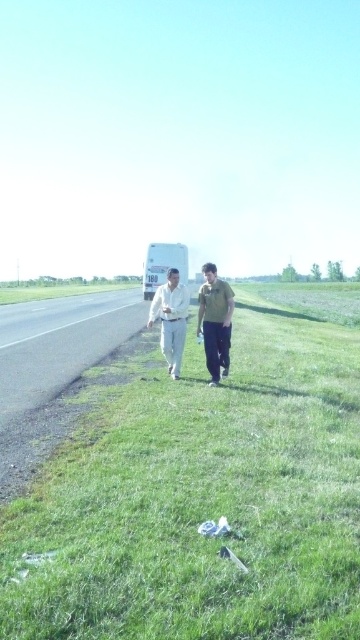
Can you confirm if asphalt road at left is positioned to the left of white cotton shirt at center?

Indeed, asphalt road at left is positioned on the left side of white cotton shirt at center.

Between point (105, 304) and point (178, 332), which one is positioned in front?

Point (178, 332) is more forward.

The image size is (360, 640). In order to click on asphalt road at left in this screenshot , I will do `click(52, 369)`.

Can you confirm if green grass at center is shorter than asphalt road at left?

In fact, green grass at center may be taller than asphalt road at left.

Which of these two, green grass at center or asphalt road at left, stands taller?

green grass at center is taller.

Where is `green grass at center`? Image resolution: width=360 pixels, height=640 pixels. green grass at center is located at coordinates (203, 490).

Can you confirm if green grass at center is shorter than white matte trailer truck at center?

Yes.

Who is more forward, (59, 492) or (186, 250)?

Positioned in front is point (59, 492).

Where is `green grass at center`? The image size is (360, 640). green grass at center is located at coordinates (203, 490).